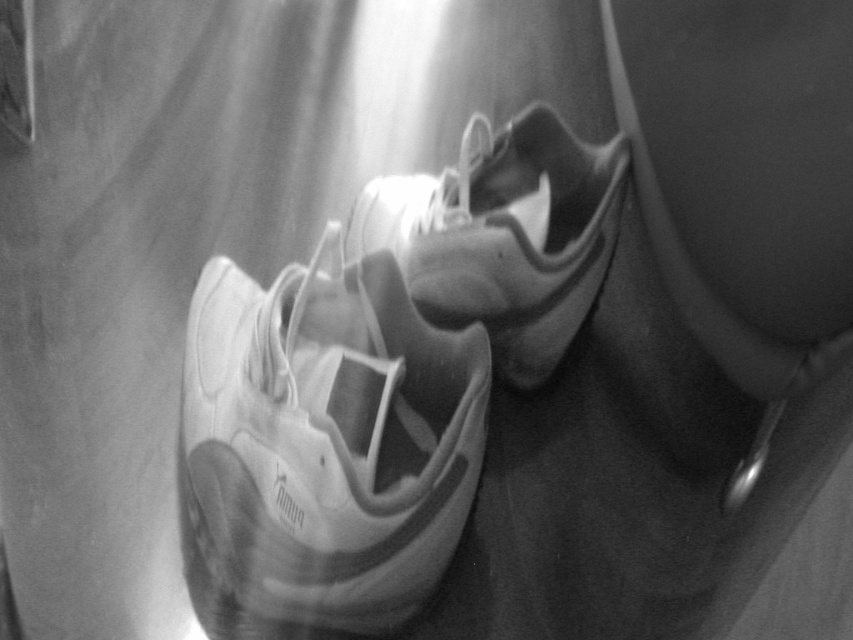
Between white matte shoe at center and white matte sneaker at center, which one has more height?

white matte shoe at center

The width and height of the screenshot is (853, 640). I want to click on white matte shoe at center, so click(x=326, y=445).

This screenshot has height=640, width=853. In order to click on white matte shoe at center in this screenshot , I will do `click(326, 445)`.